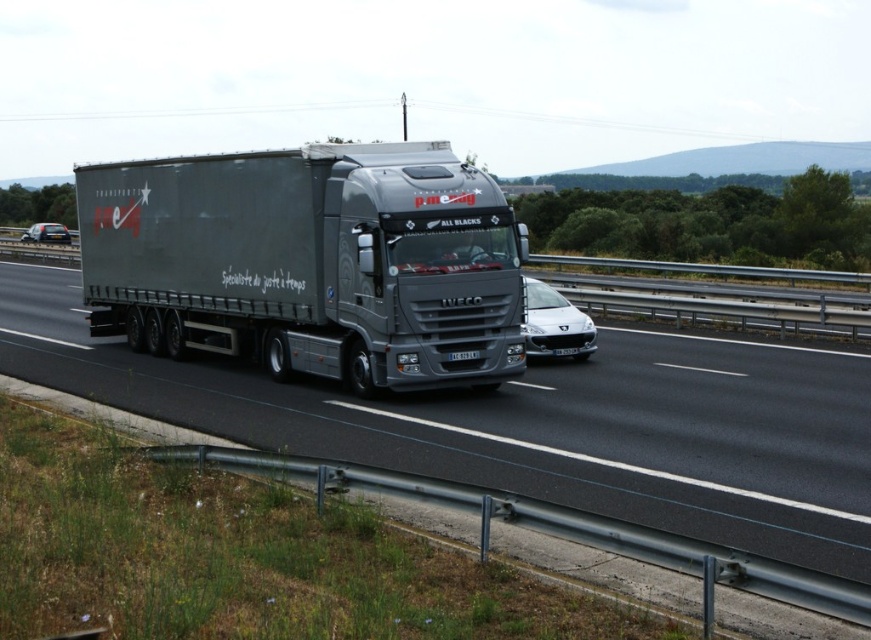
Between metallic truck at center and matte black trailer truck at left, which one appears on the right side from the viewer's perspective?

From the viewer's perspective, metallic truck at center appears more on the right side.

Consider the image. Who is more distant from viewer, (58, 385) or (460, 337)?

Positioned behind is point (58, 385).

What are the coordinates of `metallic truck at center` in the screenshot? It's located at (534, 422).